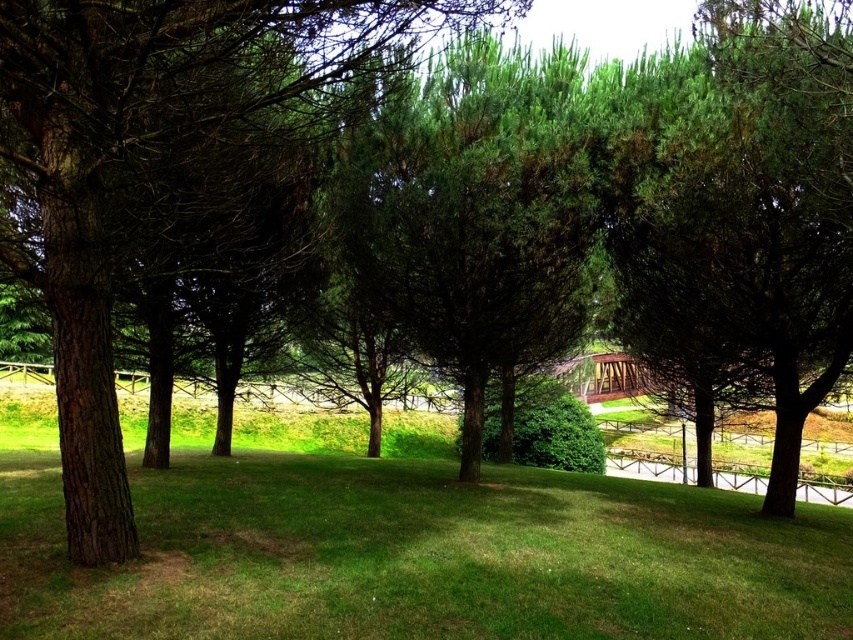
Question: Among these points, which one is farthest from the camera?

Choices:
 (A) (218, 22)
 (B) (219, 572)

Answer: (B)

Question: Is green grassy at center smaller than green textured tree at center?

Choices:
 (A) yes
 (B) no

Answer: (A)

Question: Is green grassy at center in front of green textured tree at center?

Choices:
 (A) yes
 (B) no

Answer: (B)

Question: Does green grassy at center appear over green textured tree at center?

Choices:
 (A) no
 (B) yes

Answer: (A)

Question: Which point is closer to the camera taking this photo?

Choices:
 (A) (697, 625)
 (B) (33, 12)

Answer: (B)